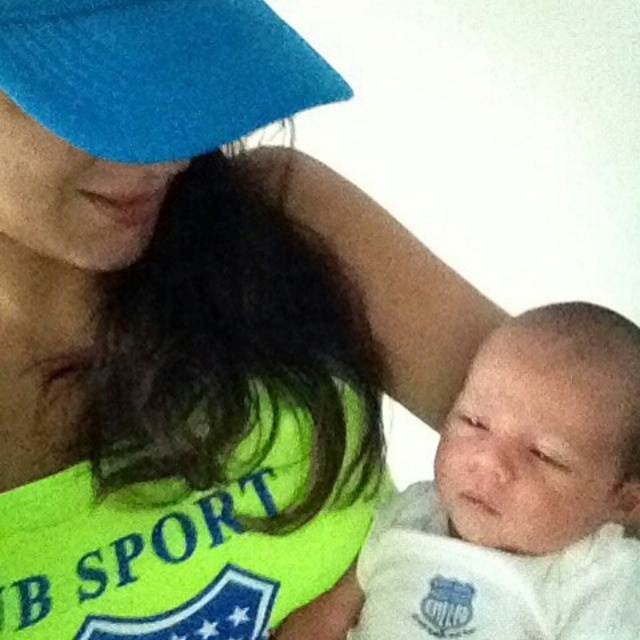
You are a photographer setting up for a photo shoot. You have a white soft cloth at center and a blue felt hat at upper left. To ensure proper lighting, you need to know the position of these items relative to each other. Which object is located to the right of the other?

The white soft cloth at center is positioned on the right side of blue felt hat at upper left.

You are a photographer setting up for a family photo. You notice a point at coordinates [522,496] in the image. What object is located at this point?

The point at coordinates [522,496] corresponds to the white soft cloth at center.